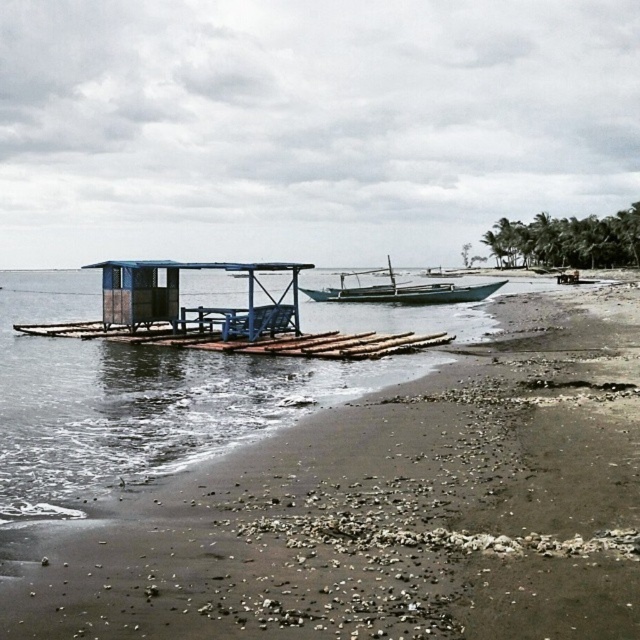
Looking at this image, is brown sandy beach at lower left thinner than wooden boat at center?

Yes, brown sandy beach at lower left is thinner than wooden boat at center.

The image size is (640, 640). Describe the element at coordinates (392, 508) in the screenshot. I see `brown sandy beach at lower left` at that location.

Image resolution: width=640 pixels, height=640 pixels. What do you see at coordinates (392, 508) in the screenshot?
I see `brown sandy beach at lower left` at bounding box center [392, 508].

This screenshot has height=640, width=640. What are the coordinates of `brown sandy beach at lower left` in the screenshot? It's located at (392, 508).